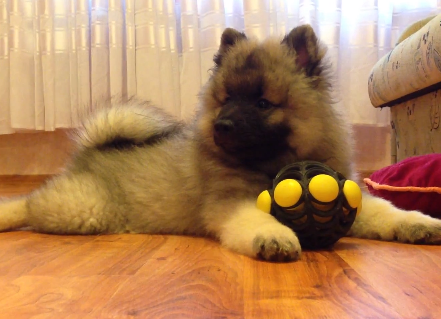
The height and width of the screenshot is (319, 441). What are the coordinates of `couch on right` in the screenshot? It's located at (419, 114).